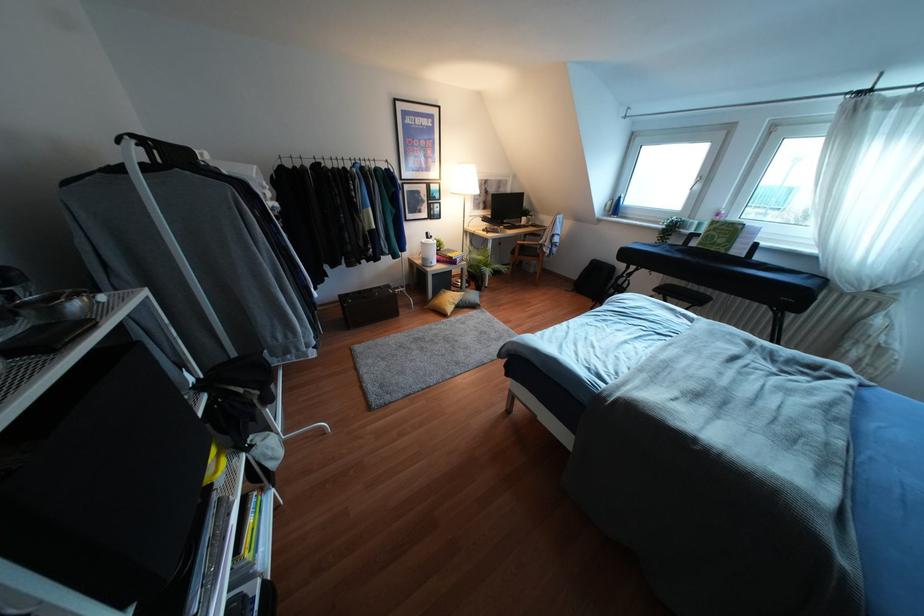
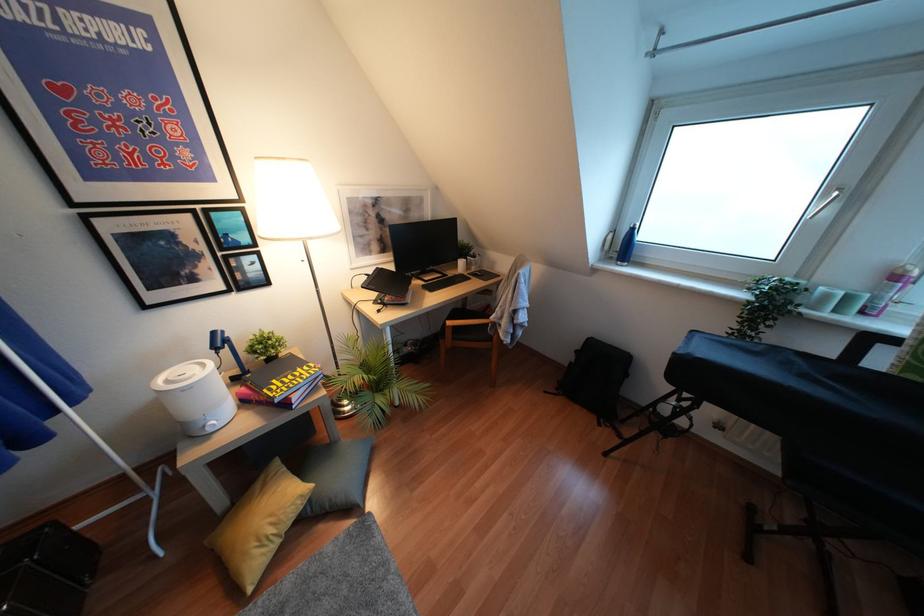
Locate, in the second image, the point that corresponds to pixel 716 214 in the first image.

(895, 277)